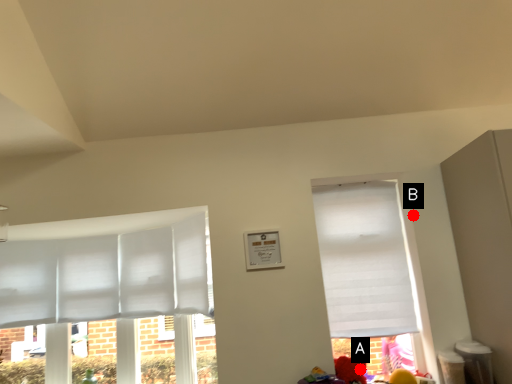
Question: Two points are circled on the image, labeled by A and B beside each circle. Which of the following is the farthest from the observer?

Choices:
 (A) A is further
 (B) B is further

Answer: (B)